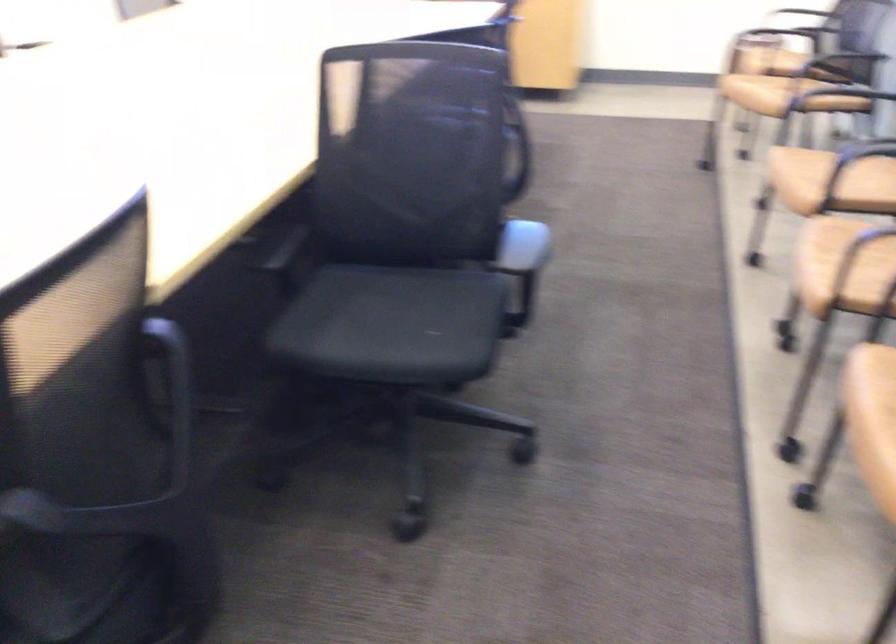
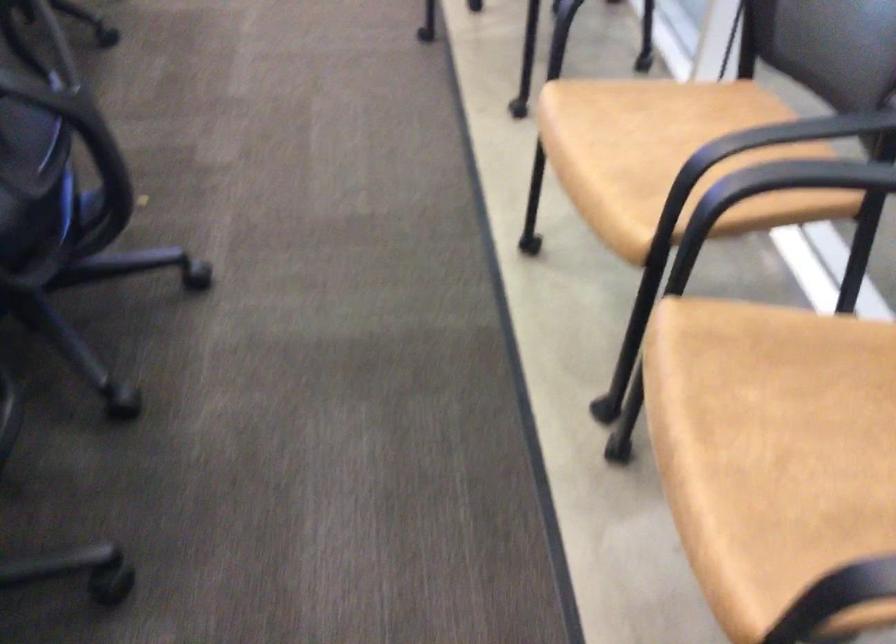
Question: Which direction would the cameraman need to move to produce the second image? Reply with the corresponding letter.

Choices:
 (A) Left
 (B) Right
 (C) Forward
 (D) Backward

Answer: (C)